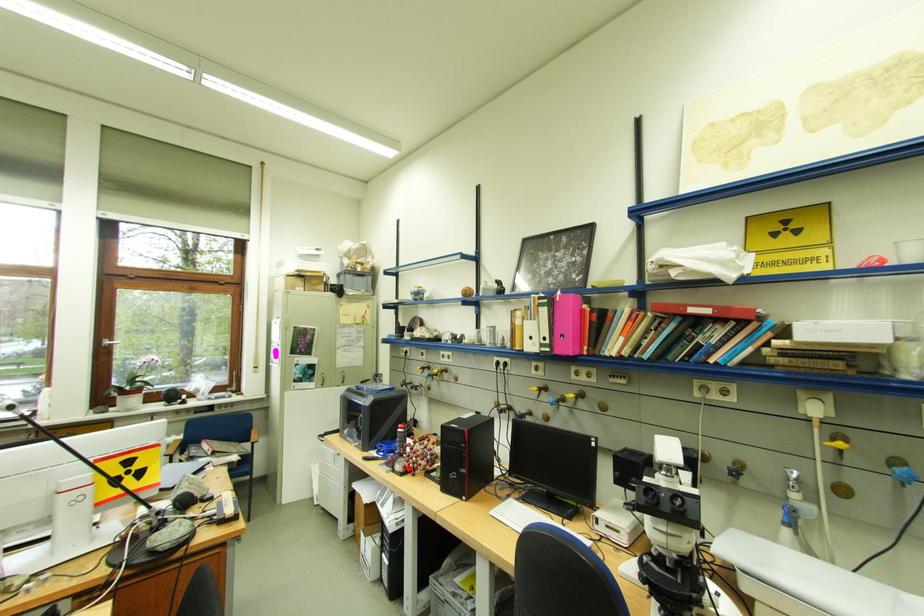
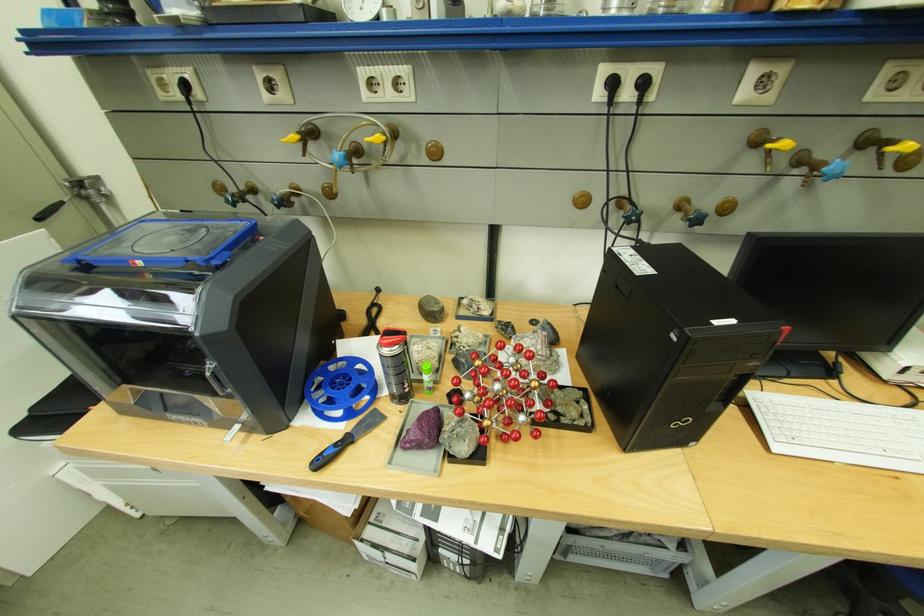
Question: I am providing you with two images of the same scene from different viewpoints. In image1, a red point is highlighted. Considering the same 3D point in image2, which of the following is correct?

Choices:
 (A) It is closer
 (B) It is farther

Answer: (A)